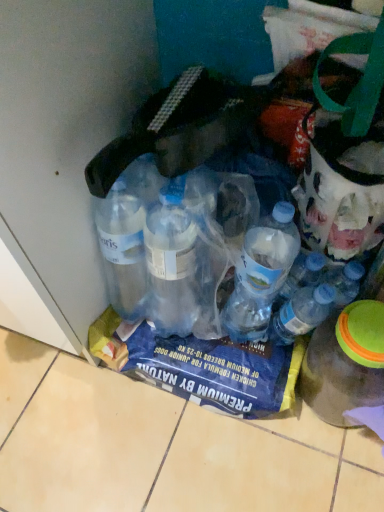
This screenshot has width=384, height=512. Identify the location of transparent plastic bottles at lower left, the third bottle positioned from the right. (232, 193).

The width and height of the screenshot is (384, 512). What are the coordinates of `transparent plastic bottle at lower right, which is the 1th bottle from right to left` in the screenshot? It's located at (345, 362).

The image size is (384, 512). What are the coordinates of `transparent plastic bottles at lower left, the 1th bottle when ordered from left to right` in the screenshot? It's located at (232, 193).

From a real-world perspective, relative to translucent plastic bottle at center, which is counted as the second bottle, starting from the right, is transparent plastic bottle at lower right, which is the 1th bottle from right to left, vertically above or below?

From a real-world perspective, transparent plastic bottle at lower right, which is the 1th bottle from right to left, is physically below translucent plastic bottle at center, which is counted as the second bottle, starting from the right.

From the image's perspective, which one is positioned lower, transparent plastic bottle at lower right, which is the 1th bottle from right to left, or translucent plastic bottle at center, placed as the 2th bottle when sorted from left to right?

transparent plastic bottle at lower right, which is the 1th bottle from right to left, is shown below in the image.

Could you tell me if transparent plastic bottle at lower right, arranged as the 3th bottle when viewed from the left, is turned towards translucent plastic bottle at center, placed as the 2th bottle when sorted from left to right?

No, transparent plastic bottle at lower right, arranged as the 3th bottle when viewed from the left, does not turn towards translucent plastic bottle at center, placed as the 2th bottle when sorted from left to right.

Is transparent plastic bottles at lower left, the 1th bottle when ordered from left to right, located within transparent plastic bottle at lower right, arranged as the 3th bottle when viewed from the left?

That's incorrect, transparent plastic bottles at lower left, the 1th bottle when ordered from left to right, is not inside transparent plastic bottle at lower right, arranged as the 3th bottle when viewed from the left.

Considering the positions of point (352, 334) and point (271, 192), is point (352, 334) closer or farther from the camera than point (271, 192)?

Point (352, 334).

Can you confirm if transparent plastic bottle at lower right, which is the 1th bottle from right to left, is shorter than transparent plastic bottles at lower left, the 1th bottle when ordered from left to right?

Correct, transparent plastic bottle at lower right, which is the 1th bottle from right to left, is not as tall as transparent plastic bottles at lower left, the 1th bottle when ordered from left to right.

Which is more to the right, transparent plastic bottle at lower right, arranged as the 3th bottle when viewed from the left, or transparent plastic bottles at lower left, the third bottle positioned from the right?

Positioned to the right is transparent plastic bottle at lower right, arranged as the 3th bottle when viewed from the left.

Is transparent plastic bottles at lower left, the 1th bottle when ordered from left to right, taller or shorter than translucent plastic bottle at center, placed as the 2th bottle when sorted from left to right?

In the image, transparent plastic bottles at lower left, the 1th bottle when ordered from left to right, appears to be taller than translucent plastic bottle at center, placed as the 2th bottle when sorted from left to right.

Starting from the translucent plastic bottle at center, which is counted as the second bottle, starting from the right, which bottle is the 2nd one in front? Please provide its 2D coordinates.

[(232, 193)]

How many degrees apart are the facing directions of transparent plastic bottles at lower left, the third bottle positioned from the right, and translucent plastic bottle at center, which is counted as the second bottle, starting from the right?

0.00393 degrees separate the facing orientations of transparent plastic bottles at lower left, the third bottle positioned from the right, and translucent plastic bottle at center, which is counted as the second bottle, starting from the right.

From the image's perspective, does transparent plastic bottles at lower left, the 1th bottle when ordered from left to right, appear higher than translucent plastic bottle at center, which is counted as the second bottle, starting from the right?

Yes.

How much distance is there between transparent plastic bottles at lower left, the 1th bottle when ordered from left to right, and transparent plastic bottle at lower right, which is the 1th bottle from right to left?

The distance of transparent plastic bottles at lower left, the 1th bottle when ordered from left to right, from transparent plastic bottle at lower right, which is the 1th bottle from right to left, is 10.29 inches.

Which object is wider, transparent plastic bottles at lower left, the third bottle positioned from the right, or transparent plastic bottle at lower right, arranged as the 3th bottle when viewed from the left?

With larger width is transparent plastic bottles at lower left, the third bottle positioned from the right.

Choose the correct answer: Is transparent plastic bottles at lower left, the third bottle positioned from the right, inside transparent plastic bottle at lower right, arranged as the 3th bottle when viewed from the left, or outside it?

transparent plastic bottles at lower left, the third bottle positioned from the right, exists outside the volume of transparent plastic bottle at lower right, arranged as the 3th bottle when viewed from the left.

From the image's perspective, starting from the transparent plastic bottles at lower left, the third bottle positioned from the right, which bottle is the 2nd one below? Please provide its 2D coordinates.

[(345, 362)]

Is translucent plastic bottle at center, placed as the 2th bottle when sorted from left to right, shorter than transparent plastic bottles at lower left, the 1th bottle when ordered from left to right?

Yes, translucent plastic bottle at center, placed as the 2th bottle when sorted from left to right, is shorter than transparent plastic bottles at lower left, the 1th bottle when ordered from left to right.

Which object is thinner, translucent plastic bottle at center, which is counted as the second bottle, starting from the right, or transparent plastic bottles at lower left, the 1th bottle when ordered from left to right?

Thinner between the two is translucent plastic bottle at center, which is counted as the second bottle, starting from the right.

Is point (283, 311) closer to viewer compared to point (156, 314)?

Yes, point (283, 311) is in front of point (156, 314).

Does translucent plastic bottle at center, placed as the 2th bottle when sorted from left to right, turn towards transparent plastic bottle at lower right, arranged as the 3th bottle when viewed from the left?

No.

From the image's perspective, which object appears higher, translucent plastic bottle at center, which is counted as the second bottle, starting from the right, or transparent plastic bottle at lower right, arranged as the 3th bottle when viewed from the left?

translucent plastic bottle at center, which is counted as the second bottle, starting from the right, appears higher in the image.

From a real-world perspective, does translucent plastic bottle at center, which is counted as the second bottle, starting from the right, stand above transparent plastic bottle at lower right, arranged as the 3th bottle when viewed from the left?

Yes, from a real-world perspective, translucent plastic bottle at center, which is counted as the second bottle, starting from the right, is on top of transparent plastic bottle at lower right, arranged as the 3th bottle when viewed from the left.

Based on their positions, is translucent plastic bottle at center, placed as the 2th bottle when sorted from left to right, located to the left or right of transparent plastic bottle at lower right, arranged as the 3th bottle when viewed from the left?

translucent plastic bottle at center, placed as the 2th bottle when sorted from left to right, is positioned on transparent plastic bottle at lower right, arranged as the 3th bottle when viewed from the left,'s left side.

In the image, there is a translucent plastic bottle at center, which is counted as the second bottle, starting from the right. Where is `bottle below it (from the image's perspective)`? This screenshot has height=512, width=384. bottle below it (from the image's perspective) is located at coordinates (345, 362).

Find the location of a particular element. This screenshot has width=384, height=512. bottle that appears in front of the transparent plastic bottle at lower right, arranged as the 3th bottle when viewed from the left is located at coordinates (232, 193).

Looking at the image, which one is located further to transparent plastic bottles at lower left, the 1th bottle when ordered from left to right, translucent plastic bottle at center, which is counted as the second bottle, starting from the right, or transparent plastic bottle at lower right, arranged as the 3th bottle when viewed from the left?

transparent plastic bottle at lower right, arranged as the 3th bottle when viewed from the left, is positioned further to the anchor transparent plastic bottles at lower left, the 1th bottle when ordered from left to right.

From the picture: Looking at the image, which one is located closer to translucent plastic bottle at center, placed as the 2th bottle when sorted from left to right, transparent plastic bottles at lower left, the third bottle positioned from the right, or transparent plastic bottle at lower right, arranged as the 3th bottle when viewed from the left?

Among the two, transparent plastic bottle at lower right, arranged as the 3th bottle when viewed from the left, is located nearer to translucent plastic bottle at center, placed as the 2th bottle when sorted from left to right.

Estimate the real-world distances between objects in this image. Which object is closer to transparent plastic bottle at lower right, which is the 1th bottle from right to left, translucent plastic bottle at center, placed as the 2th bottle when sorted from left to right, or transparent plastic bottles at lower left, the third bottle positioned from the right?

translucent plastic bottle at center, placed as the 2th bottle when sorted from left to right, lies closer to transparent plastic bottle at lower right, which is the 1th bottle from right to left, than the other object.

When comparing their distances from translucent plastic bottle at center, which is counted as the second bottle, starting from the right, does transparent plastic bottle at lower right, which is the 1th bottle from right to left, or transparent plastic bottles at lower left, the 1th bottle when ordered from left to right, seem closer?

transparent plastic bottle at lower right, which is the 1th bottle from right to left, lies closer to translucent plastic bottle at center, which is counted as the second bottle, starting from the right, than the other object.

Based on their spatial positions, is transparent plastic bottle at lower right, arranged as the 3th bottle when viewed from the left, or translucent plastic bottle at center, which is counted as the second bottle, starting from the right, closer to transparent plastic bottles at lower left, the 1th bottle when ordered from left to right?

Among the two, translucent plastic bottle at center, which is counted as the second bottle, starting from the right, is located nearer to transparent plastic bottles at lower left, the 1th bottle when ordered from left to right.

Looking at the image, which one is located further to transparent plastic bottle at lower right, which is the 1th bottle from right to left, transparent plastic bottles at lower left, the 1th bottle when ordered from left to right, or translucent plastic bottle at center, which is counted as the second bottle, starting from the right?

transparent plastic bottles at lower left, the 1th bottle when ordered from left to right, is further to transparent plastic bottle at lower right, which is the 1th bottle from right to left.

Identify the location of bottle located between transparent plastic bottles at lower left, the 1th bottle when ordered from left to right, and transparent plastic bottle at lower right, which is the 1th bottle from right to left, in the left-right direction. The image size is (384, 512). (301, 313).